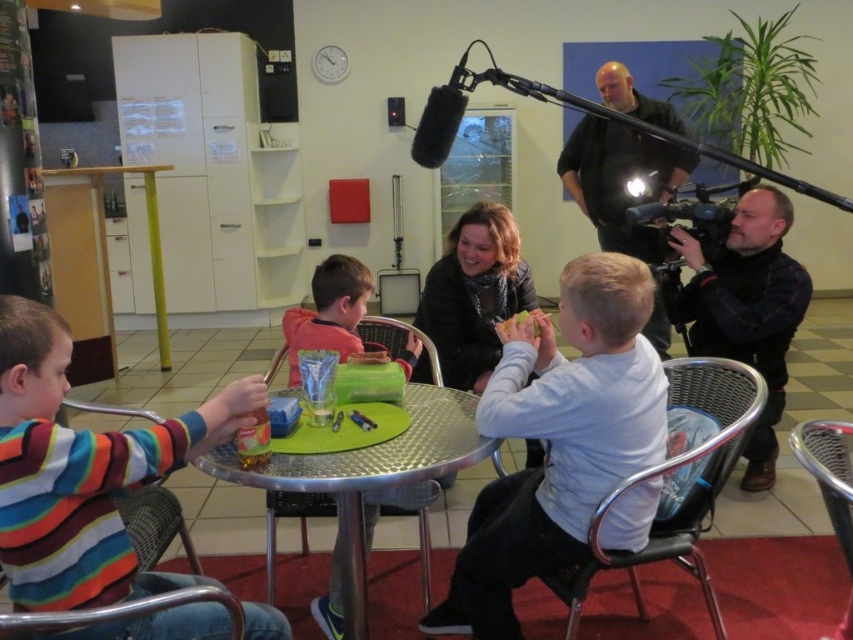
Based on the photo, you are standing at the center of the image and want to locate the dark gray shirt at upper right. Which direction should you look to find it?

The dark gray shirt at upper right is located at point (619, 179), so you should look towards the upper right direction to find it.

Based on the coordinates provided, can you identify which object corresponds to the point labeled as point (558,438)?

The point (558,438) corresponds to the white matte shirt at center.